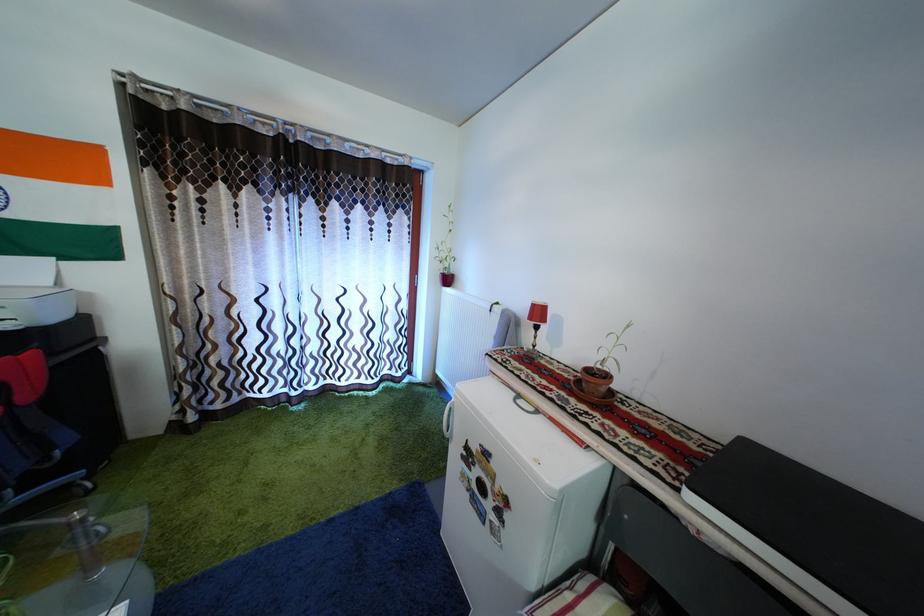
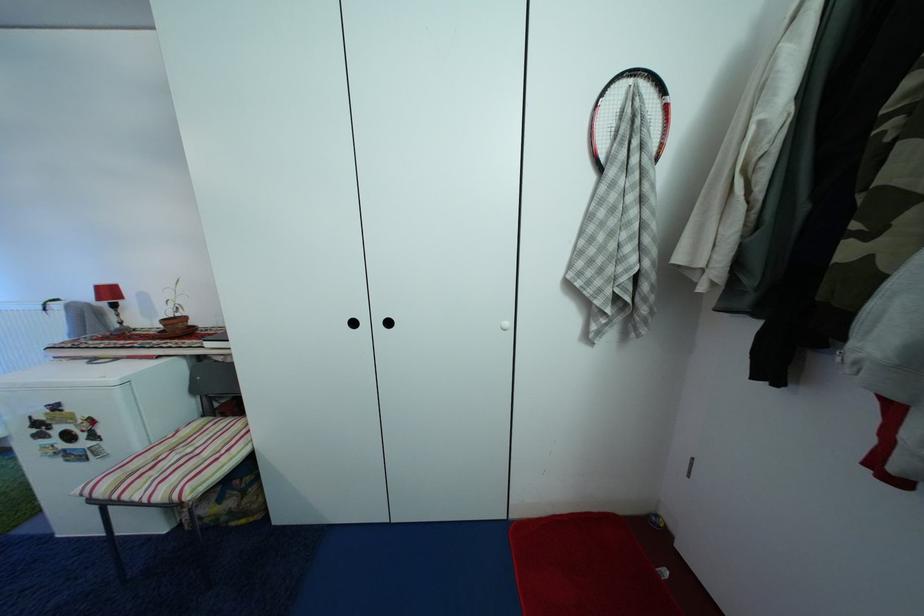
In the second image, find the point that corresponds to point 594,378 in the first image.

(174, 326)